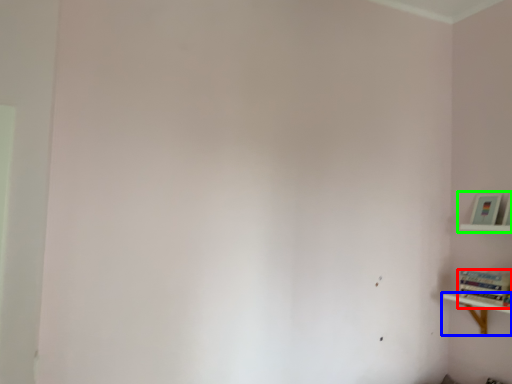
Question: Based on their relative distances, which object is farther from book (highlighted by a red box)? Choose from shelf (highlighted by a blue box) and shelf (highlighted by a green box).

Choices:
 (A) shelf
 (B) shelf

Answer: (B)